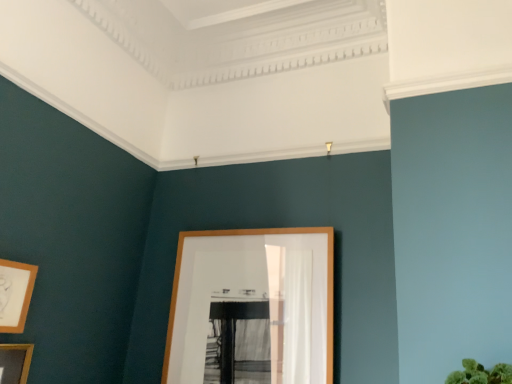
Question: From a real-world perspective, is wooden picture frame at lower left, the 2th picture frame when ordered from right to left, above or below wooden picture frame at center, the 1th picture frame positioned from the right?

Choices:
 (A) above
 (B) below

Answer: (B)

Question: Based on their positions, is wooden picture frame at lower left, the 2th picture frame when ordered from right to left, located to the left or right of wooden picture frame at center, positioned as the third picture frame in left-to-right order?

Choices:
 (A) left
 (B) right

Answer: (A)

Question: Which object is the farthest from the wooden picture frame at lower left, acting as the 3th picture frame starting from the right?

Choices:
 (A) wooden picture frame at center, positioned as the third picture frame in left-to-right order
 (B) wooden picture frame at lower left, the 2th picture frame when ordered from right to left

Answer: (A)

Question: Estimate the real-world distances between objects in this image. Which object is farther from the wooden picture frame at lower left, which ranks as the 1th picture frame in left-to-right order?

Choices:
 (A) wooden picture frame at center, the 1th picture frame positioned from the right
 (B) wooden picture frame at lower left, which ranks as the 2th picture frame in left-to-right order

Answer: (A)